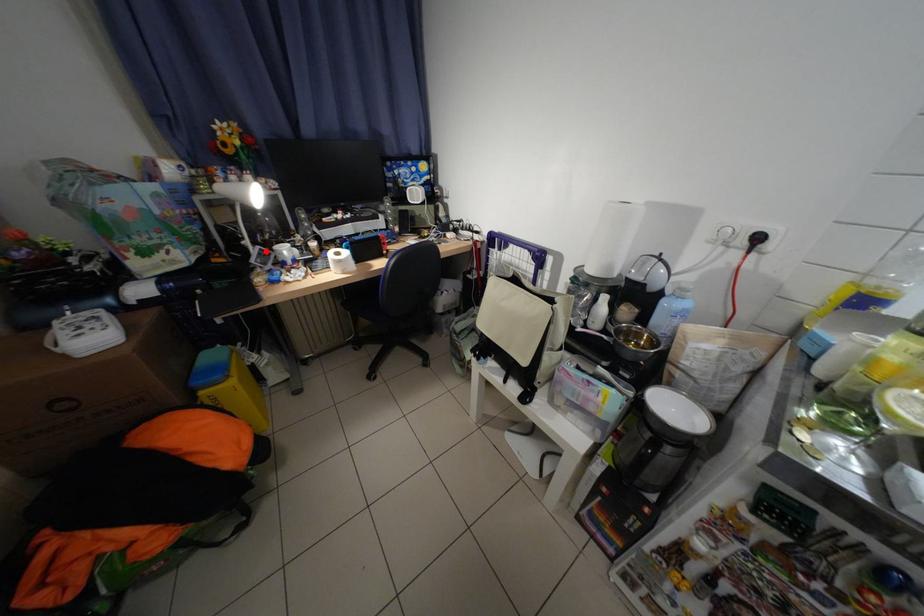
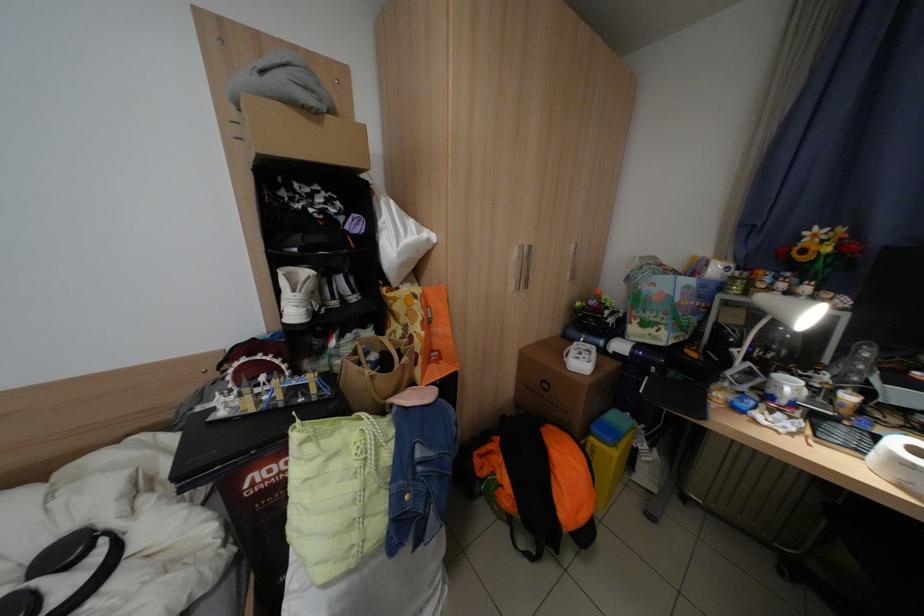
Find the pixel in the second image that matches the highlighted location in the first image.

(752, 366)